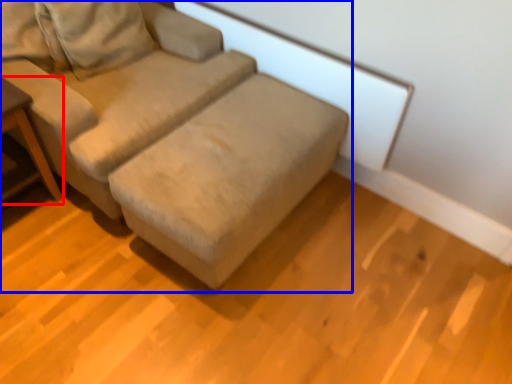
Question: Among these objects, which one is nearest to the camera, table (highlighted by a red box) or studio couch (highlighted by a blue box)?

Choices:
 (A) table
 (B) studio couch

Answer: (B)